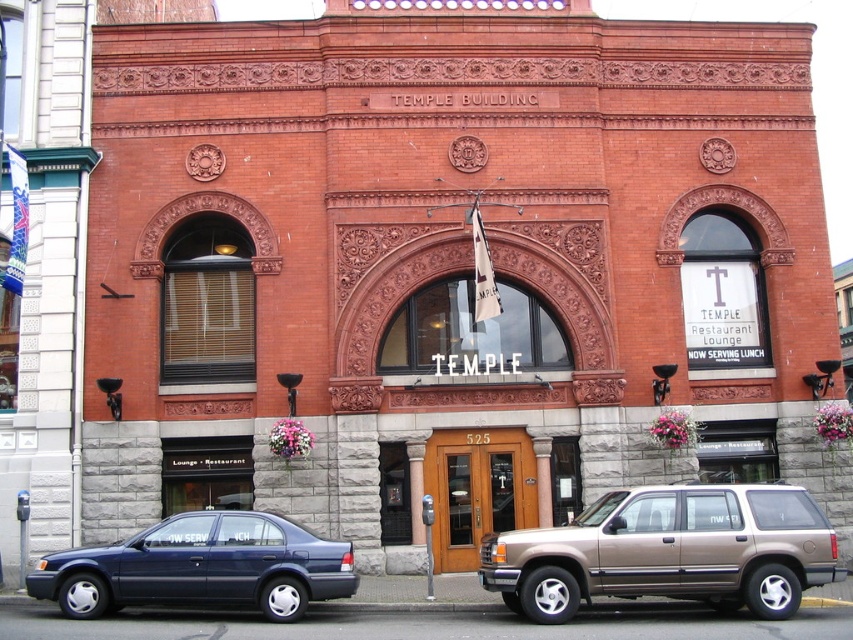
Where is `gold metallic suv at center`? gold metallic suv at center is located at coordinates (669, 552).

Is point (706, 502) closer to camera compared to point (212, 582)?

No, (706, 502) is behind (212, 582).

Where is `gold metallic suv at center`? The height and width of the screenshot is (640, 853). gold metallic suv at center is located at coordinates (669, 552).